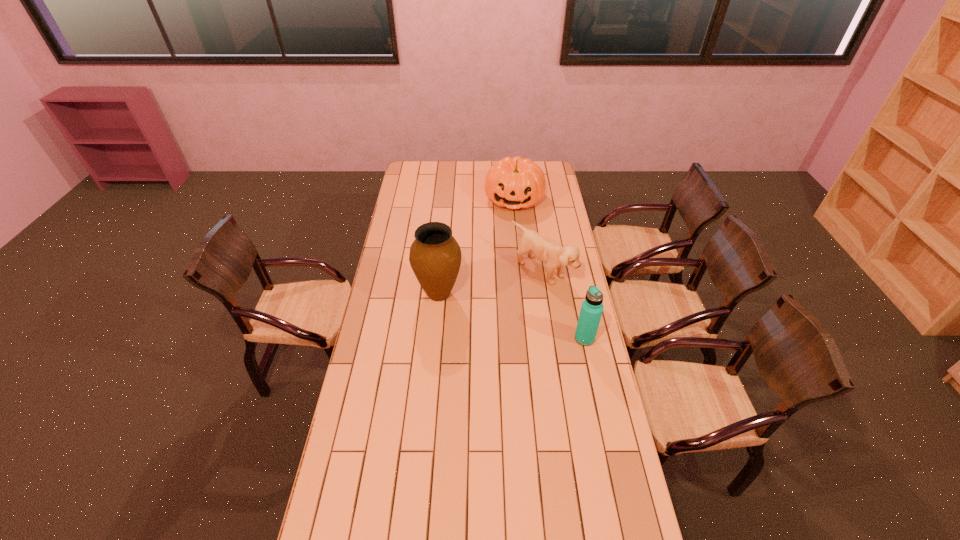
Where is `urn`? This screenshot has height=540, width=960. urn is located at coordinates (435, 256).

At what (x,y) coordinates should I click in order to perform the action: click on the tallest object. Please return your answer as a coordinate pair (x, y). Looking at the image, I should click on tap(435, 256).

Where is `the nearest object`? The image size is (960, 540). the nearest object is located at coordinates (592, 307).

Where is `puppy`? puppy is located at coordinates click(x=555, y=256).

Where is `the farthest object`? This screenshot has width=960, height=540. the farthest object is located at coordinates (514, 183).

Where is `vacant space located 0.360m on the front of the urn`? The image size is (960, 540). vacant space located 0.360m on the front of the urn is located at coordinates (430, 384).

Find the location of `vacant region located 0.390m on the left of the nearest object`. vacant region located 0.390m on the left of the nearest object is located at coordinates (479, 339).

The image size is (960, 540). I want to click on blank area located on the left side of the puppy, so click(515, 293).

Identify the location of blank space located on the left side of the puppy. (455, 335).

Find the location of a particular element. The image size is (960, 540). vacant region located on the left side of the puppy is located at coordinates (513, 294).